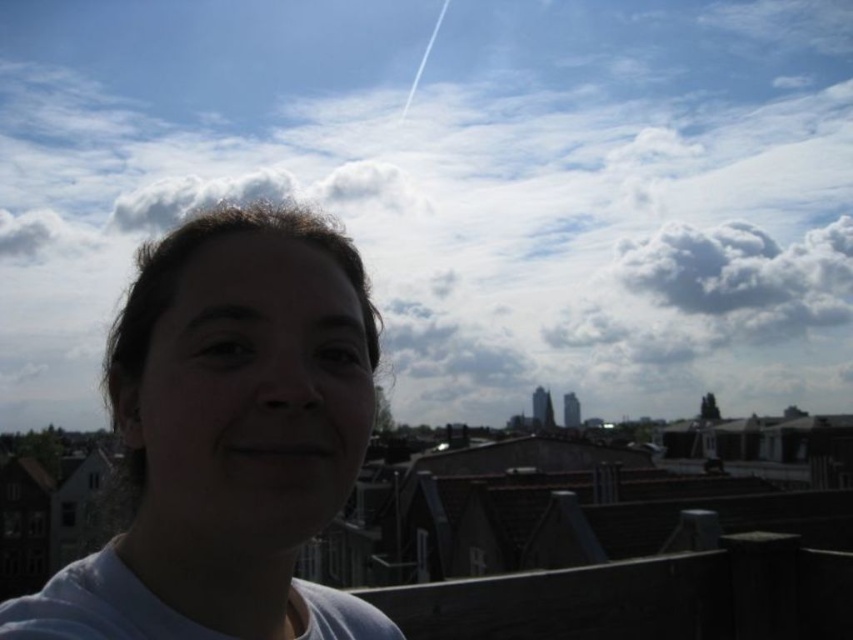
Question: Can you confirm if white fluffy cloud at upper center is bigger than white matte face at center?

Choices:
 (A) no
 (B) yes

Answer: (B)

Question: Does white fluffy cloud at upper center have a larger size compared to white matte face at center?

Choices:
 (A) no
 (B) yes

Answer: (B)

Question: Which object appears farthest from the camera in this image?

Choices:
 (A) white fluffy cloud at upper center
 (B) white matte face at center

Answer: (A)

Question: Which object is closer to the camera taking this photo?

Choices:
 (A) white fluffy cloud at upper center
 (B) white matte face at center

Answer: (B)

Question: Does white fluffy cloud at upper center appear over white matte face at center?

Choices:
 (A) yes
 (B) no

Answer: (A)

Question: Which point is farther from the camera taking this photo?

Choices:
 (A) (334, 67)
 (B) (270, 257)

Answer: (A)